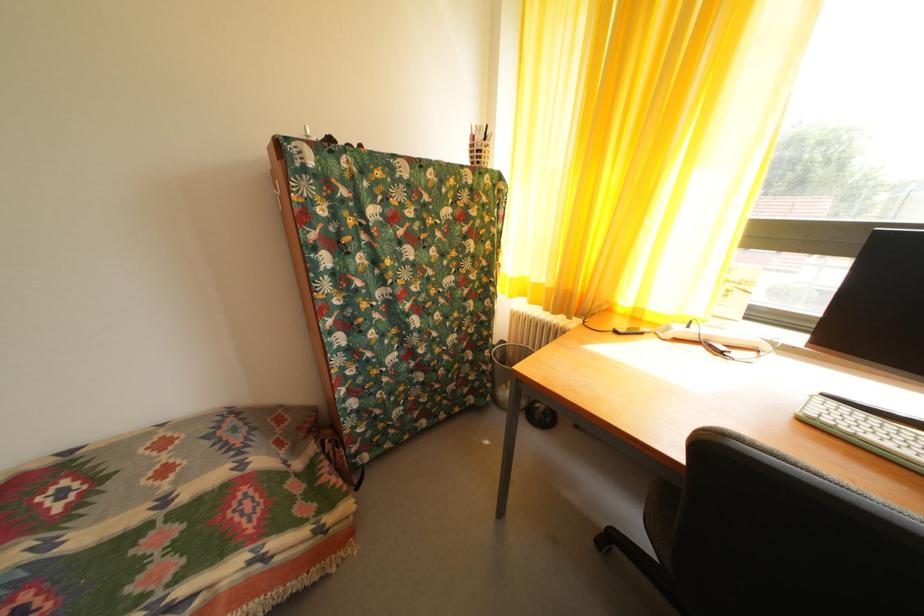
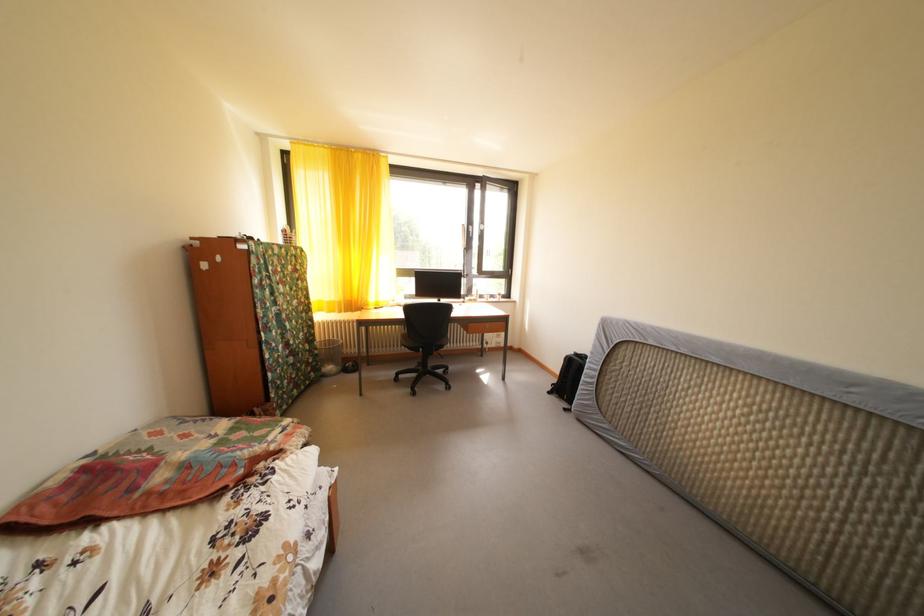
Where in the second image is the point corresponding to [481,369] from the first image?

(320, 357)